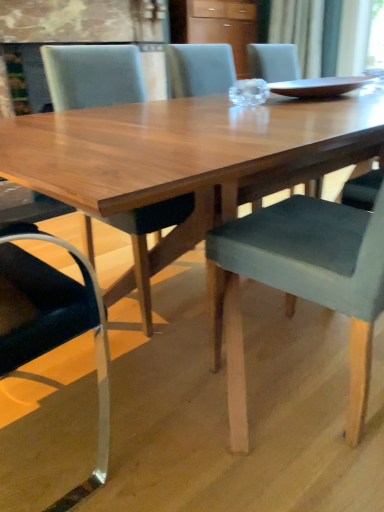
Question: Would you say matte brown tray at center is outside wooden cabinet at upper center?

Choices:
 (A) no
 (B) yes

Answer: (B)

Question: From a real-world perspective, is matte brown tray at center positioned under wooden cabinet at upper center based on gravity?

Choices:
 (A) no
 (B) yes

Answer: (B)

Question: Is matte brown tray at center thinner than wooden cabinet at upper center?

Choices:
 (A) no
 (B) yes

Answer: (B)

Question: Is matte brown tray at center at the left side of wooden cabinet at upper center?

Choices:
 (A) yes
 (B) no

Answer: (B)

Question: From the image's perspective, is matte brown tray at center above wooden cabinet at upper center?

Choices:
 (A) yes
 (B) no

Answer: (B)

Question: From the image's perspective, is matte brown tray at center located above or below velvet grey chair at center, the first chair when ordered from right to left?

Choices:
 (A) below
 (B) above

Answer: (B)

Question: Is matte brown tray at center bigger or smaller than velvet grey chair at center, positioned as the second chair in left-to-right order?

Choices:
 (A) big
 (B) small

Answer: (B)

Question: Is point (362, 81) positioned closer to the camera than point (299, 275)?

Choices:
 (A) closer
 (B) farther

Answer: (B)

Question: Which is correct: matte brown tray at center is inside velvet grey chair at center, positioned as the second chair in left-to-right order, or outside of it?

Choices:
 (A) inside
 (B) outside

Answer: (B)

Question: Is matte gray chair at center, the first chair when ordered from left to right, inside or outside of wooden cabinet at upper center?

Choices:
 (A) outside
 (B) inside

Answer: (A)

Question: Considering the relative positions of matte gray chair at center, which is the 2th chair from right to left, and wooden cabinet at upper center in the image provided, is matte gray chair at center, which is the 2th chair from right to left, to the left or to the right of wooden cabinet at upper center?

Choices:
 (A) right
 (B) left

Answer: (B)

Question: Relative to wooden cabinet at upper center, is matte gray chair at center, the first chair when ordered from left to right, in front or behind?

Choices:
 (A) behind
 (B) front

Answer: (B)

Question: From their relative heights in the image, would you say matte gray chair at center, which is the 2th chair from right to left, is taller or shorter than wooden cabinet at upper center?

Choices:
 (A) tall
 (B) short

Answer: (A)

Question: In terms of height, does matte brown tray at center look taller or shorter compared to wooden cabinet at upper center?

Choices:
 (A) short
 (B) tall

Answer: (A)

Question: From a real-world perspective, is matte brown tray at center above or below wooden cabinet at upper center?

Choices:
 (A) below
 (B) above

Answer: (A)